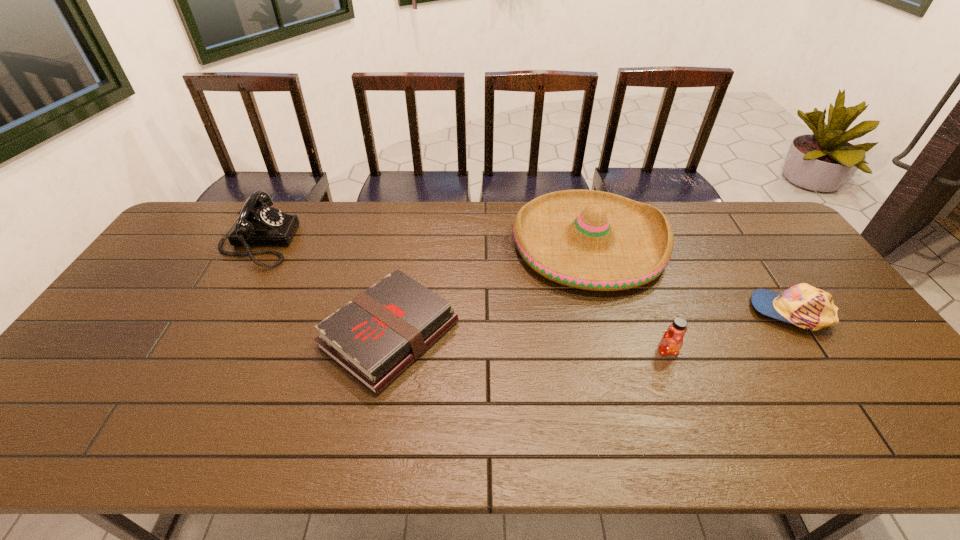
You are a GUI agent. You are given a task and a screenshot of the screen. Output one action in this format:
    pyautogui.click(x=<x>, y=<y>)
    Task: Click on the vacant space in between the shortest object and the honey
    Image resolution: width=960 pixels, height=540 pixels.
    Given the screenshot: What is the action you would take?
    pyautogui.click(x=529, y=343)

Locate an element on the screen. Image resolution: width=960 pixels, height=540 pixels. free space between the sombrero and the telephone is located at coordinates (423, 243).

Locate which object ranks fourth in proximity to the leftmost object. Please provide its 2D coordinates. Your answer should be formatted as a tuple, i.e. [(x, y)], where the tuple contains the x and y coordinates of a point satisfying the conditions above.

[(805, 306)]

Locate an element on the screen. The image size is (960, 540). object that can be found as the third closest to the hardback book is located at coordinates coord(672,340).

This screenshot has height=540, width=960. Identify the location of free point that satisfies the following two spatial constraints: 1. on the bill of the cap; 2. on the front side of the shortest object. (807, 335).

At what (x,y) coordinates should I click in order to perform the action: click on vacant space that satisfies the following two spatial constraints: 1. on the dial of the leftmost object; 2. on the back side of the shortest object. Please return your answer as a coordinate pair (x, y). Looking at the image, I should click on (204, 335).

Identify the location of free space in the image that satisfies the following two spatial constraints: 1. on the dial of the telephone; 2. on the back side of the sombrero. Image resolution: width=960 pixels, height=540 pixels. (256, 244).

Find the location of a particular element. The width and height of the screenshot is (960, 540). free spot that satisfies the following two spatial constraints: 1. on the bill of the rightmost object; 2. on the front label of the third shortest object is located at coordinates (818, 351).

I want to click on vacant space that satisfies the following two spatial constraints: 1. on the dial of the telephone; 2. on the right side of the sombrero, so click(256, 244).

The width and height of the screenshot is (960, 540). I want to click on vacant space that satisfies the following two spatial constraints: 1. on the bill of the cap; 2. on the front side of the hardback book, so click(807, 335).